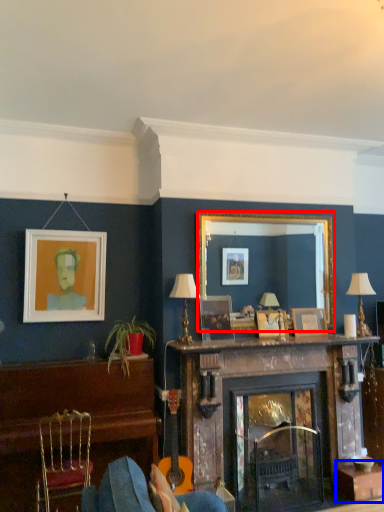
Question: Which object is closer to the camera taking this photo, mirror (highlighted by a red box) or table (highlighted by a blue box)?

Choices:
 (A) mirror
 (B) table

Answer: (B)